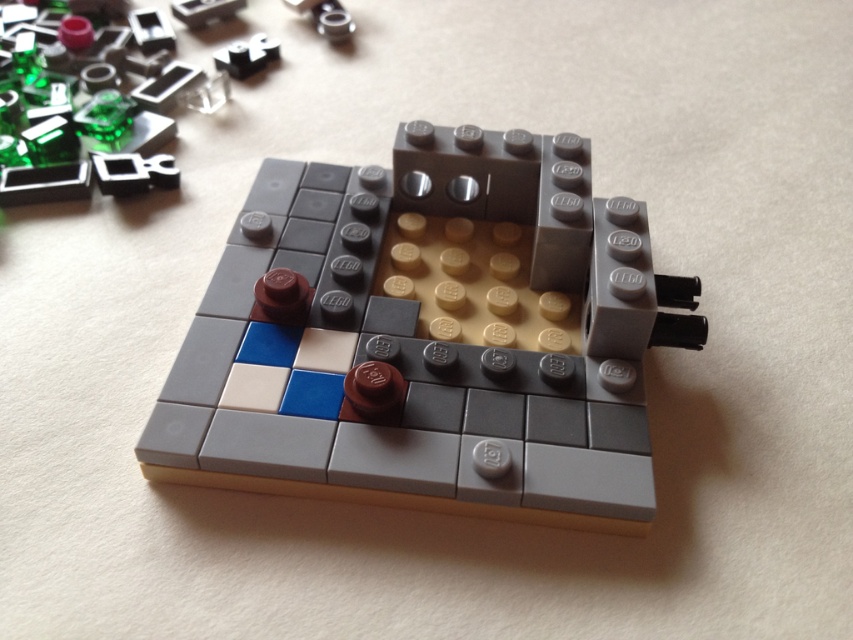
Which is more to the left, matte gray lego structure at center or transparent green plastic at upper left?

transparent green plastic at upper left is more to the left.

Is point (531, 330) in front of point (143, 156)?

Yes, it is.

What do you see at coordinates (431, 340) in the screenshot?
I see `matte gray lego structure at center` at bounding box center [431, 340].

You are a GUI agent. You are given a task and a screenshot of the screen. Output one action in this format:
    pyautogui.click(x=<x>, y=<y>)
    Task: Click on the matte gray lego structure at center
    This screenshot has height=640, width=853.
    Given the screenshot: What is the action you would take?
    pyautogui.click(x=431, y=340)